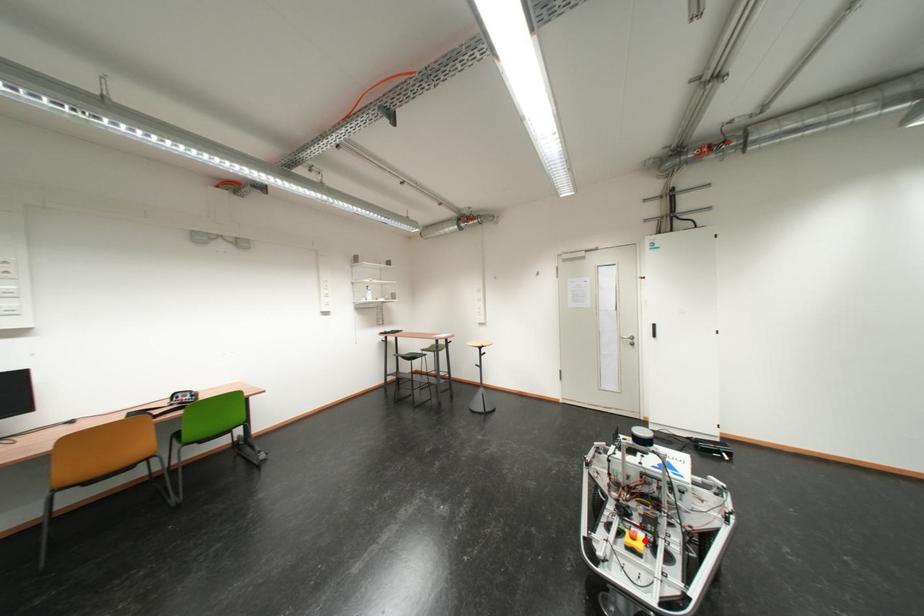
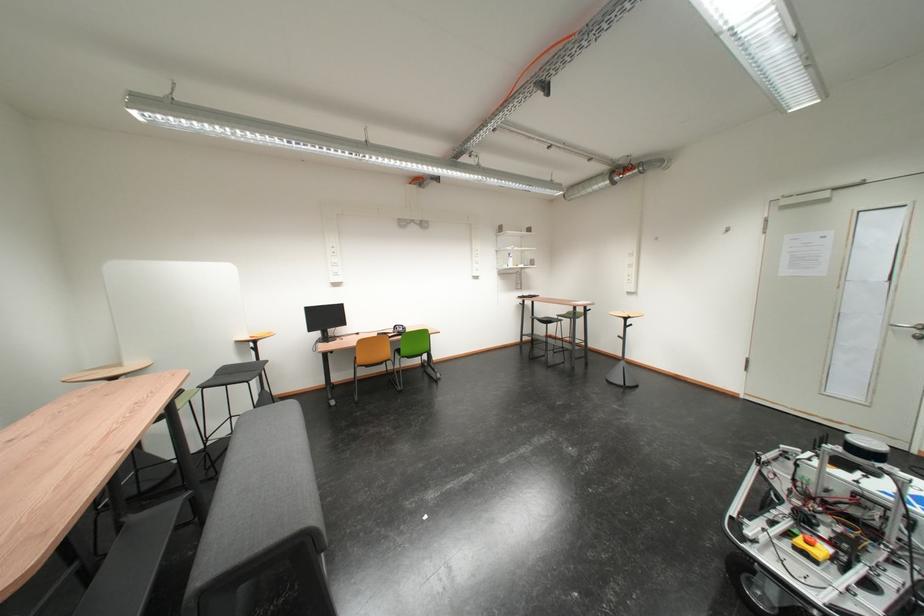
Question: I am providing you with two images of the same scene from different viewpoints. Given a red point in image1, look at the same physical point in image2. Is it:

Choices:
 (A) Closer to the viewpoint
 (B) Farther from the viewpoint

Answer: (B)